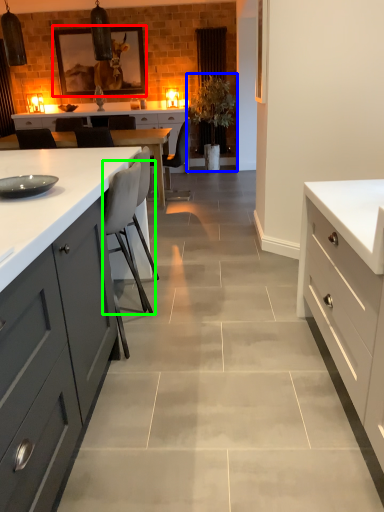
Question: Which object is the farthest from picture frame (highlighted by a red box)? Choose among these: plant (highlighted by a blue box) or chair (highlighted by a green box).

Choices:
 (A) plant
 (B) chair

Answer: (B)